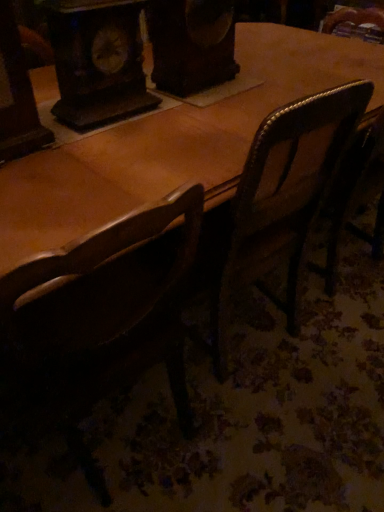
Where is `space that is in front of wooden clock at upper left`? Image resolution: width=384 pixels, height=512 pixels. space that is in front of wooden clock at upper left is located at coordinates pyautogui.click(x=115, y=140).